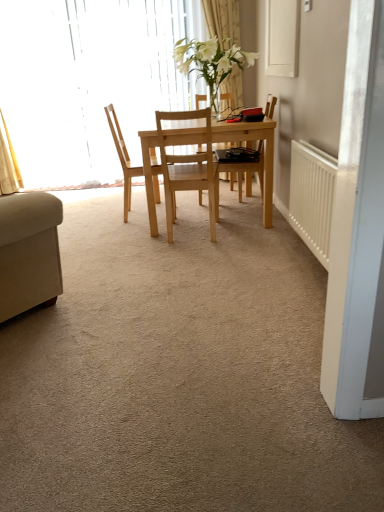
The width and height of the screenshot is (384, 512). What are the coordinates of `light wood table at center` in the screenshot? It's located at (249, 143).

Measure the distance between point (195,94) and camera.

The distance of point (195,94) from camera is 4.04 meters.

What do you see at coordinates (89, 80) in the screenshot? I see `translucent glass window at upper left` at bounding box center [89, 80].

Image resolution: width=384 pixels, height=512 pixels. Describe the element at coordinates (211, 61) in the screenshot. I see `white glossy vase at center` at that location.

Find the location of a particular element. natural wood chair at center, the 1th chair when ordered from left to right is located at coordinates (122, 158).

Find the location of a particular element. The image size is (384, 512). light wood table at center is located at coordinates (249, 143).

Which of these two, natural wood chair at center, the 1th chair when ordered from left to right, or white sheer curtain at upper center, is wider?

With larger width is natural wood chair at center, the 1th chair when ordered from left to right.

From a real-world perspective, is natural wood chair at center, the 1th chair when ordered from left to right, physically located above or below white sheer curtain at upper center?

In terms of real-world spatial position, natural wood chair at center, the 1th chair when ordered from left to right, is below white sheer curtain at upper center.

Does point (155, 199) appear closer or farther from the camera than point (222, 10)?

Point (155, 199).

Could you measure the distance between natural wood chair at center, the second chair when ordered from right to left, and translucent glass window at upper left?

natural wood chair at center, the second chair when ordered from right to left, and translucent glass window at upper left are 3.90 feet apart from each other.

Which object is positioned more to the left, natural wood chair at center, the 1th chair when ordered from left to right, or translucent glass window at upper left?

translucent glass window at upper left.

Is natural wood chair at center, the 1th chair when ordered from left to right, directly adjacent to translucent glass window at upper left?

natural wood chair at center, the 1th chair when ordered from left to right, and translucent glass window at upper left are clearly separated.

Which of these two, natural wood chair at center, the second chair when ordered from right to left, or translucent glass window at upper left, is smaller?

natural wood chair at center, the second chair when ordered from right to left.

From the picture: Considering the positions of objects translucent glass window at upper left and natural wood chair at center, positioned as the 1th chair in right-to-left order, in the image provided, who is more to the left, translucent glass window at upper left or natural wood chair at center, positioned as the 1th chair in right-to-left order,?

translucent glass window at upper left is more to the left.

From the image's perspective, which is below, translucent glass window at upper left or natural wood chair at center, arranged as the 2th chair when viewed from the left?

natural wood chair at center, arranged as the 2th chair when viewed from the left, appears lower in the image.

From a real-world perspective, is translucent glass window at upper left over natural wood chair at center, positioned as the 1th chair in right-to-left order?

Yes, from a real-world perspective, translucent glass window at upper left is on top of natural wood chair at center, positioned as the 1th chair in right-to-left order.

At what (x,y) coordinates should I click in order to perform the action: click on window lying behind the natural wood chair at center, positioned as the 1th chair in right-to-left order. Please return your answer as a coordinate pair (x, y). The width and height of the screenshot is (384, 512). Looking at the image, I should click on (89, 80).

Is natural wood chair at center, positioned as the 1th chair in right-to-left order, outside of natural wood chair at center, the 1th chair when ordered from left to right?

That's correct, natural wood chair at center, positioned as the 1th chair in right-to-left order, is outside of natural wood chair at center, the 1th chair when ordered from left to right.

From the image's perspective, is natural wood chair at center, arranged as the 2th chair when viewed from the left, on natural wood chair at center, the second chair when ordered from right to left?

No.

How different are the orientations of natural wood chair at center, positioned as the 1th chair in right-to-left order, and natural wood chair at center, the second chair when ordered from right to left, in degrees?

92.3 degrees separate the facing orientations of natural wood chair at center, positioned as the 1th chair in right-to-left order, and natural wood chair at center, the second chair when ordered from right to left.

Which of these two, natural wood chair at center, arranged as the 2th chair when viewed from the left, or natural wood chair at center, the second chair when ordered from right to left, is bigger?

natural wood chair at center, the second chair when ordered from right to left.

Can you confirm if light wood table at center is thinner than white sheer curtain at upper center?

No.

Are light wood table at center and white sheer curtain at upper center located far from each other?

light wood table at center is far away from white sheer curtain at upper center.

Which of these two, light wood table at center or white sheer curtain at upper center, is bigger?

With larger size is light wood table at center.

Which is farther, (217, 141) or (237, 92)?

The point (237, 92) is farther.

From a real-world perspective, is white sheer curtain at upper center on white glossy vase at center?

Yes, from a real-world perspective, white sheer curtain at upper center is above white glossy vase at center.

Is white sheer curtain at upper center smaller than white glossy vase at center?

Yes, white sheer curtain at upper center is smaller than white glossy vase at center.

I want to click on plant below the white sheer curtain at upper center (from a real-world perspective), so click(x=211, y=61).

Considering the positions of objects white sheer curtain at upper center and white glossy vase at center in the image provided, who is more to the left, white sheer curtain at upper center or white glossy vase at center?

From the viewer's perspective, white glossy vase at center appears more on the left side.

From the image's perspective, relative to natural wood chair at center, the 1th chair when ordered from left to right, is light wood table at center above or below?

Clearly, from the image's perspective, light wood table at center is below natural wood chair at center, the 1th chair when ordered from left to right.

Considering the positions of objects light wood table at center and natural wood chair at center, the second chair when ordered from right to left, in the image provided, who is in front, light wood table at center or natural wood chair at center, the second chair when ordered from right to left,?

light wood table at center.

Is light wood table at center at the left side of natural wood chair at center, the 1th chair when ordered from left to right?

No, light wood table at center is not to the left of natural wood chair at center, the 1th chair when ordered from left to right.

Could you tell me if light wood table at center is turned towards natural wood chair at center, the 1th chair when ordered from left to right?

Yes, light wood table at center is turned towards natural wood chair at center, the 1th chair when ordered from left to right.

Find the location of a particular element. the 1st chair directly beneath the white sheer curtain at upper center (from a real-world perspective) is located at coordinates (122, 158).

You are a GUI agent. You are given a task and a screenshot of the screen. Output one action in this format:
    pyautogui.click(x=<x>, y=<y>)
    Task: Click on the window above the natural wood chair at center, the 1th chair when ordered from left to right (from a real-world perspective)
    The width and height of the screenshot is (384, 512).
    Given the screenshot: What is the action you would take?
    pyautogui.click(x=89, y=80)

When comparing their distances from white sheer curtain at upper center, does white plastic radiator at right or light wood table at center seem closer?

Among the two, light wood table at center is located nearer to white sheer curtain at upper center.

Looking at this image, considering their positions, is natural wood chair at center, the second chair when ordered from right to left, positioned closer to white plastic radiator at right than white sheer curtain at upper center?

Among the two, natural wood chair at center, the second chair when ordered from right to left, is located nearer to white plastic radiator at right.

From the image, which object appears to be farther from translucent glass window at upper left, natural wood chair at center, the second chair when ordered from right to left, or white plastic radiator at right?

Based on the image, white plastic radiator at right appears to be further to translucent glass window at upper left.

Which object lies further to the anchor point translucent glass window at upper left, natural wood chair at center, positioned as the 1th chair in right-to-left order, or white glossy vase at center?

natural wood chair at center, positioned as the 1th chair in right-to-left order, is positioned further to the anchor translucent glass window at upper left.

Looking at the image, which one is located closer to white plastic radiator at right, white sheer curtain at upper center or natural wood chair at center, the 1th chair when ordered from left to right?

The object closer to white plastic radiator at right is natural wood chair at center, the 1th chair when ordered from left to right.

In the scene shown: Based on their spatial positions, is natural wood chair at center, arranged as the 2th chair when viewed from the left, or translucent glass window at upper left closer to light wood table at center?

Based on the image, natural wood chair at center, arranged as the 2th chair when viewed from the left, appears to be nearer to light wood table at center.

Estimate the real-world distances between objects in this image. Which object is further from natural wood chair at center, positioned as the 1th chair in right-to-left order, white sheer curtain at upper center or translucent glass window at upper left?

Based on the image, white sheer curtain at upper center appears to be further to natural wood chair at center, positioned as the 1th chair in right-to-left order.

From the image, which object appears to be farther from translucent glass window at upper left, white glossy vase at center or natural wood chair at center, the 1th chair when ordered from left to right?

natural wood chair at center, the 1th chair when ordered from left to right, is further to translucent glass window at upper left.

Find the location of a particular element. plant positioned between white plastic radiator at right and light wood table at center from near to far is located at coordinates (211, 61).

You are a GUI agent. You are given a task and a screenshot of the screen. Output one action in this format:
    pyautogui.click(x=<x>, y=<y>)
    Task: Click on the chair between white glossy vase at center and light wood table at center in the vertical direction
    
    Given the screenshot: What is the action you would take?
    pyautogui.click(x=122, y=158)

At what (x,y) coordinates should I click in order to perform the action: click on curtain between white plastic radiator at right and translucent glass window at upper left in the front-back direction. Please return your answer as a coordinate pair (x, y). This screenshot has width=384, height=512. Looking at the image, I should click on (223, 20).

Find the location of `chair between natural wood chair at center, the 1th chair when ordered from left to right, and light wood table at center, in the horizontal direction`. chair between natural wood chair at center, the 1th chair when ordered from left to right, and light wood table at center, in the horizontal direction is located at coordinates (186, 162).